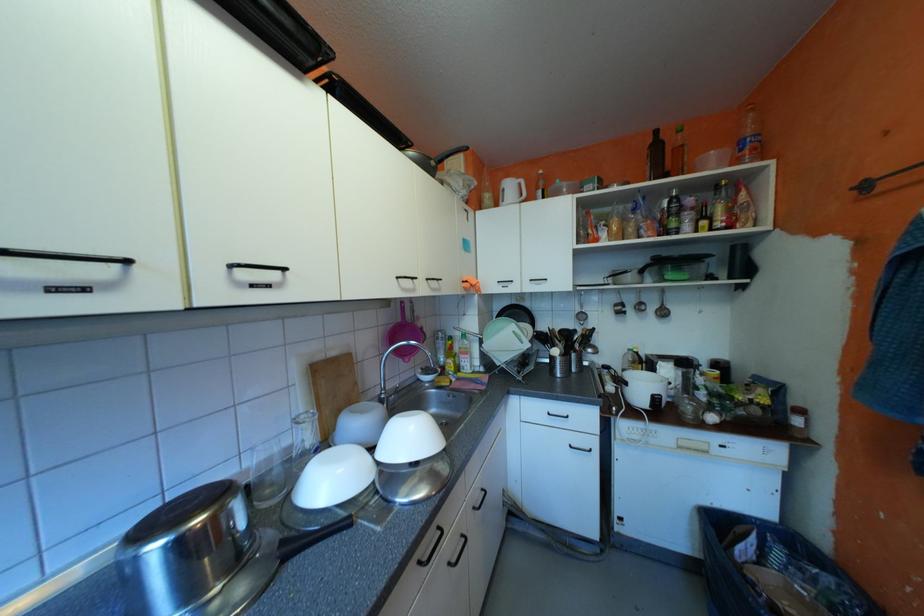
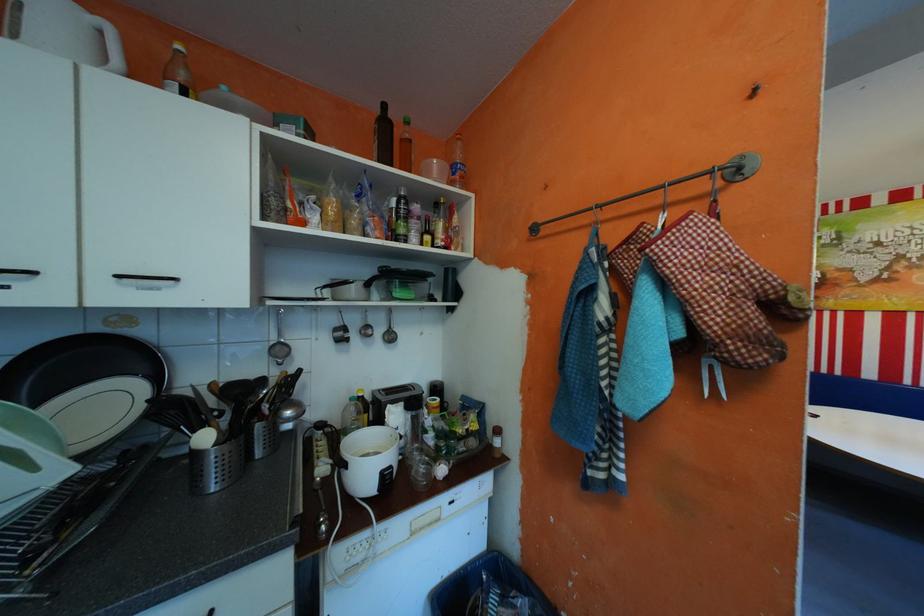
The point at (521, 185) is marked in the first image. Where is the corresponding point in the second image?

(66, 12)